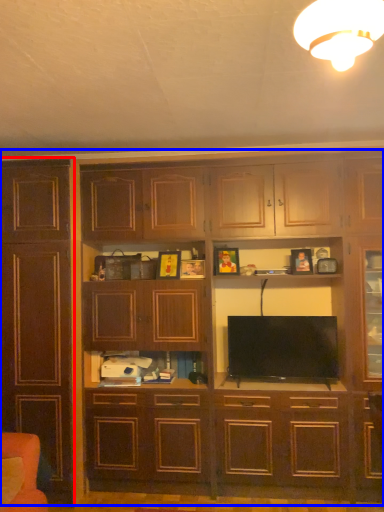
Question: Which of the following is the farthest to the observer, cabinetry (highlighted by a red box) or cupboard (highlighted by a blue box)?

Choices:
 (A) cabinetry
 (B) cupboard

Answer: (A)